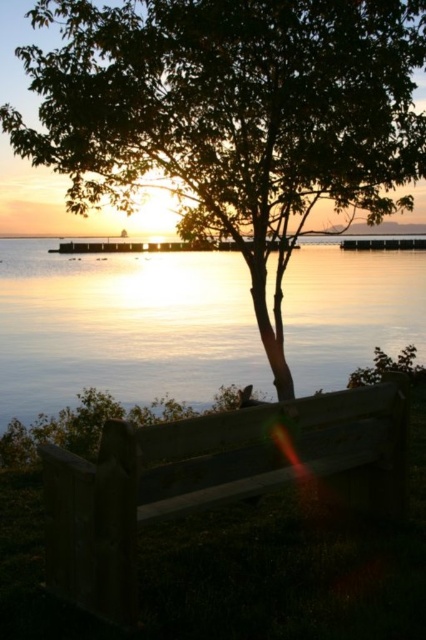
Question: Does green leafy tree at center come behind glistening silver water at center?

Choices:
 (A) yes
 (B) no

Answer: (B)

Question: Which point is closer to the camera?

Choices:
 (A) green leafy tree at center
 (B) glistening silver water at center
 (C) wooden bench at center

Answer: (C)

Question: Is green leafy tree at center closer to the viewer compared to wooden bench at center?

Choices:
 (A) no
 (B) yes

Answer: (A)

Question: Based on their relative distances, which object is nearer to the green leafy tree at center?

Choices:
 (A) wooden bench at center
 (B) glistening silver water at center

Answer: (A)

Question: Is green leafy tree at center further to camera compared to glistening silver water at center?

Choices:
 (A) yes
 (B) no

Answer: (B)

Question: Which of the following is the closest to the observer?

Choices:
 (A) green leafy tree at center
 (B) glistening silver water at center
 (C) wooden bench at center

Answer: (C)